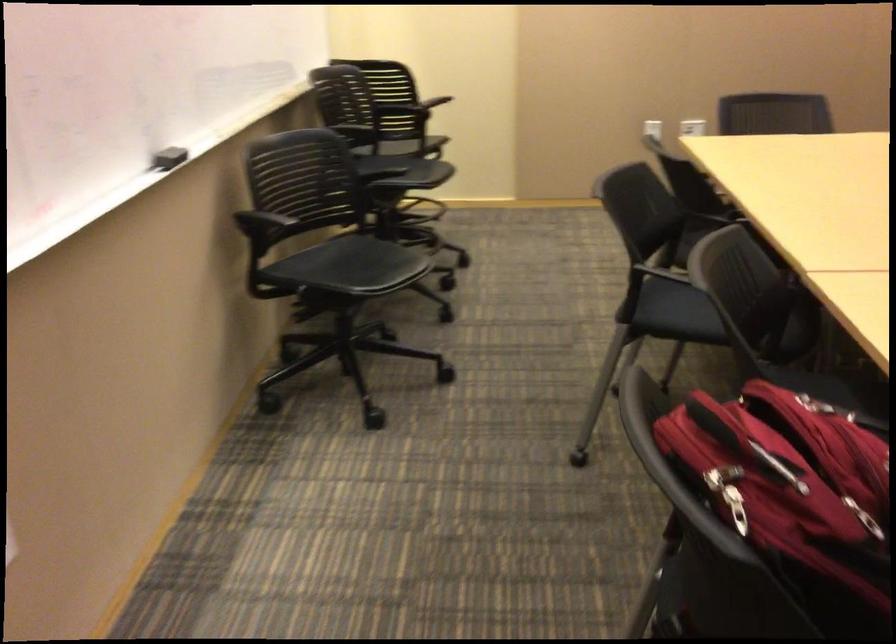
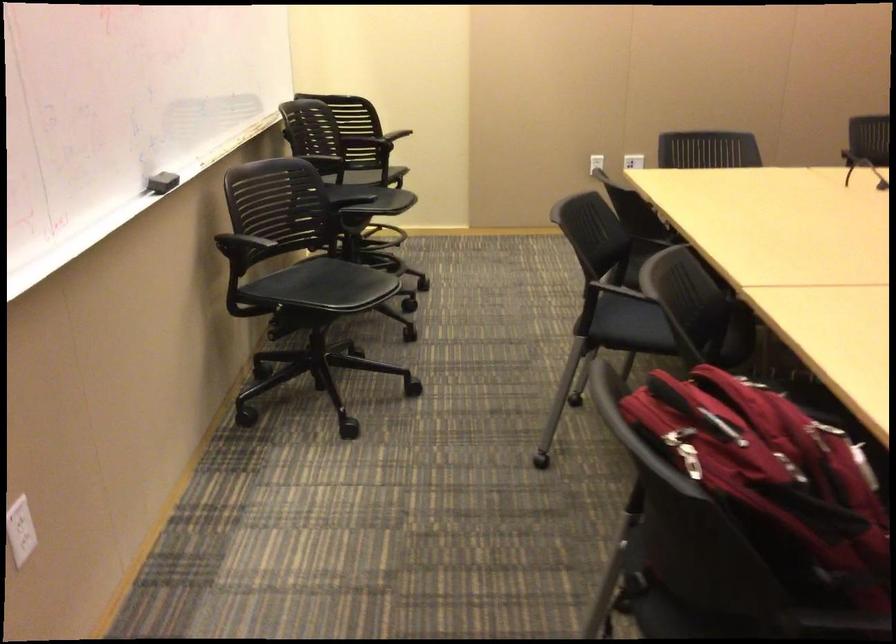
Locate, in the second image, the point that corresponds to [810,515] in the first image.

(773, 480)